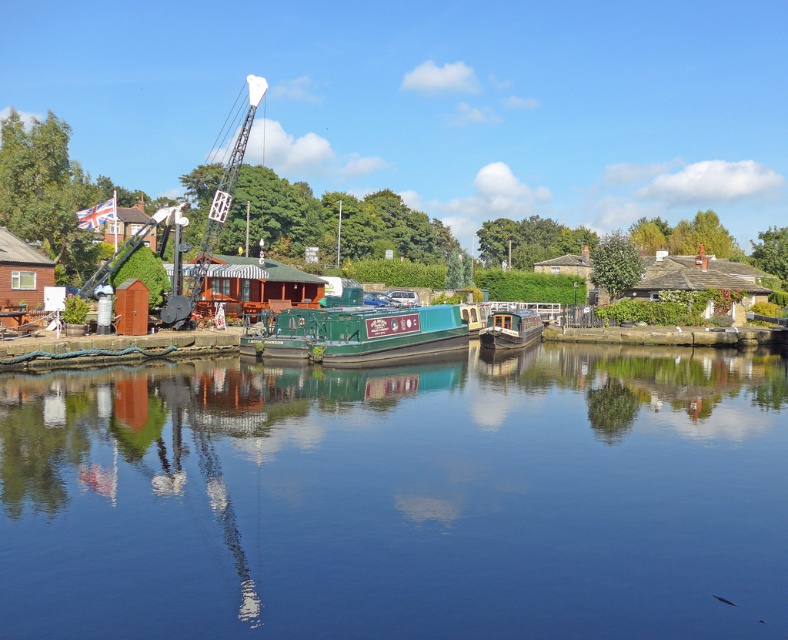
Question: Which point is farther to the camera?

Choices:
 (A) (492, 346)
 (B) (310, 326)
 (C) (214, 248)
 (D) (649, 496)

Answer: (C)

Question: Estimate the real-world distances between objects in this image. Which object is farther from the green polished wood boat at center?

Choices:
 (A) metallic industrial crane at center
 (B) wooden cabin cruiser at center

Answer: (A)

Question: Can you confirm if green polished wood boat at center is smaller than metallic industrial crane at center?

Choices:
 (A) yes
 (B) no

Answer: (A)

Question: Which of the following is the farthest from the observer?

Choices:
 (A) (389, 326)
 (B) (491, 339)
 (C) (303, 572)
 (D) (235, 122)

Answer: (D)

Question: Is metallic industrial crane at center to the left of wooden cabin cruiser at center from the viewer's perspective?

Choices:
 (A) no
 (B) yes

Answer: (B)

Question: Does green polished wood boat at center have a lesser width compared to wooden cabin cruiser at center?

Choices:
 (A) yes
 (B) no

Answer: (B)